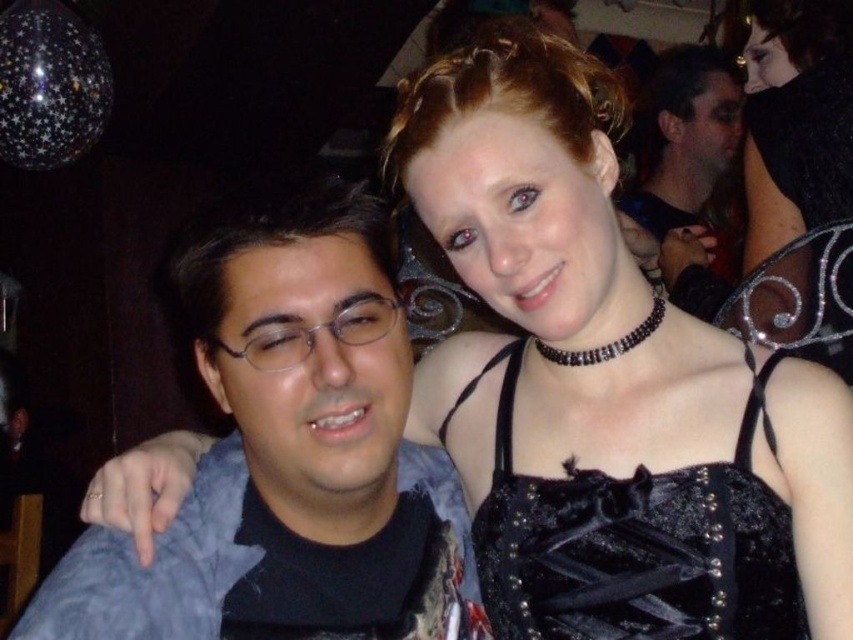
Question: Which point appears farthest from the camera in this image?

Choices:
 (A) (796, 0)
 (B) (642, 536)
 (C) (254, 536)
 (D) (672, 205)

Answer: (D)

Question: Can you confirm if black velvet dress at upper right is thinner than matte black hair at upper right?

Choices:
 (A) no
 (B) yes

Answer: (B)

Question: Does blue fabric shirt at left appear on the left side of matte black hair at upper right?

Choices:
 (A) yes
 (B) no

Answer: (A)

Question: Among these points, which one is farthest from the camera?

Choices:
 (A) (341, 477)
 (B) (662, 552)
 (C) (722, 128)

Answer: (C)

Question: Is black velvet dress at center above matte black hair at upper right?

Choices:
 (A) no
 (B) yes

Answer: (A)

Question: Which point is farther from the camera taking this photo?

Choices:
 (A) (456, 529)
 (B) (653, 144)
 (C) (514, 541)

Answer: (B)